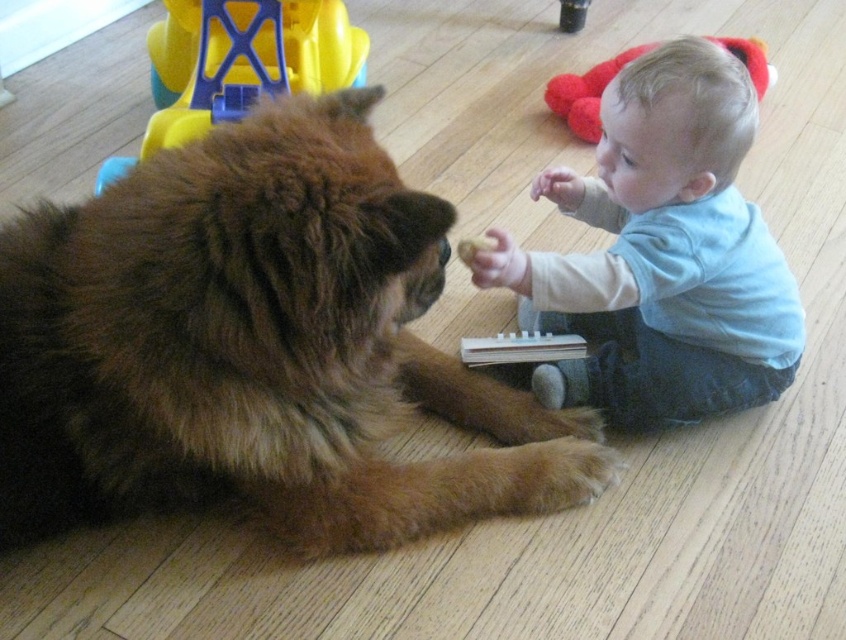
You are a parent in the room and want to place a small treat between the brown fluffy dog at center and the yellow plastic toy at upper left so both can reach it. Based on their positions, where should you place the treat?

The treat should be placed to the right of the yellow plastic toy at upper left and to the left of the brown fluffy dog at center since the brown fluffy dog at center is positioned to the right of the yellow plastic toy at upper left.

You are a parent trying to ensure the safety of your baby. The brown fluffy dog at center and the yellow plastic toy at upper left are in the room. Which object is larger and could potentially block the baby from reaching the other?

The brown fluffy dog at center is bigger than the yellow plastic toy at upper left, so it could potentially block the baby from reaching the yellow plastic toy at upper left.

Consider the image. You are a parent trying to locate your baby who is wearing a light blue cotton shirt at center. You see a mark at point (662, 253). Where is this mark located on the baby?

The mark at point (662, 253) is located on the light blue cotton shirt at center.